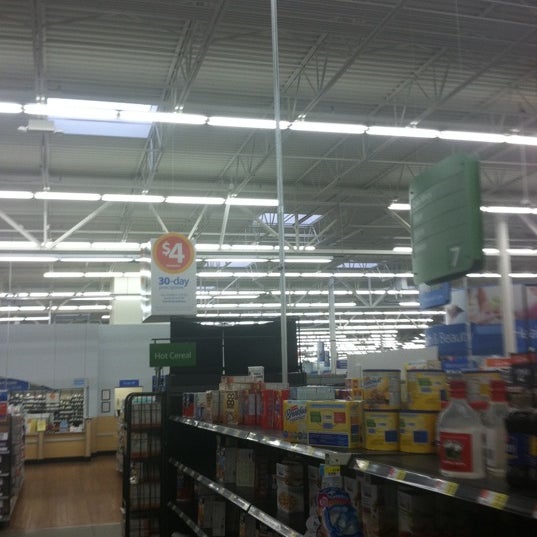
The height and width of the screenshot is (537, 537). I want to click on checkout counter, so click(62, 445), click(106, 436).